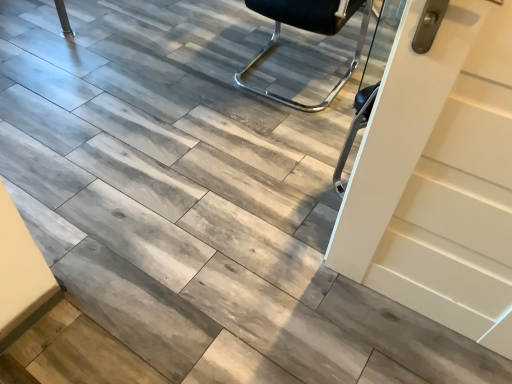
This screenshot has height=384, width=512. I want to click on vacant space situated on the left part of black leather chair at center, so click(194, 69).